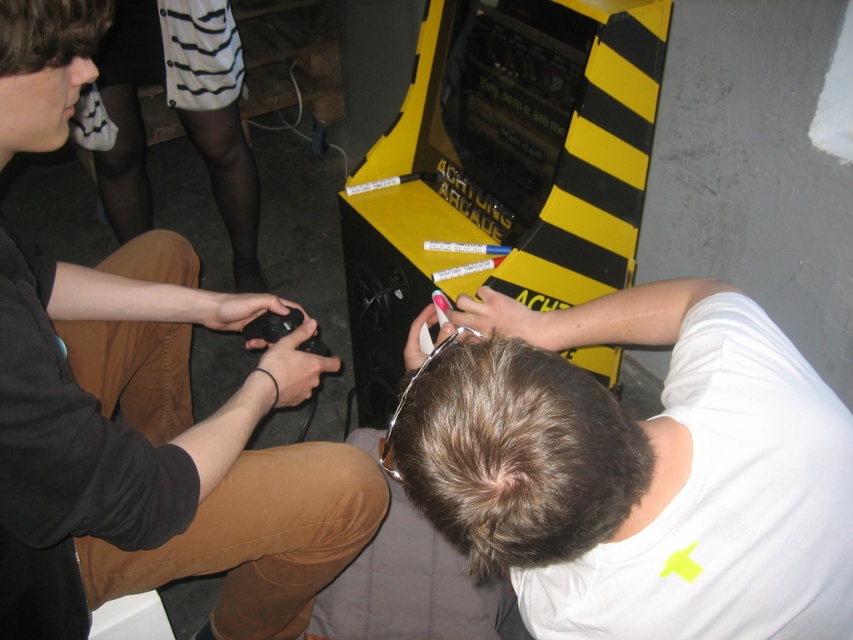
Between white matte shirt at lower right and dark brown hair at upper left, which one is positioned lower?

white matte shirt at lower right is below.

Who is positioned more to the right, white matte shirt at lower right or dark brown hair at upper left?

From the viewer's perspective, white matte shirt at lower right appears more on the right side.

Identify the location of white matte shirt at lower right. (639, 468).

Who is positioned more to the left, white matte shirt at lower right or dark brown hair at center?

Positioned to the left is dark brown hair at center.

At what (x,y) coordinates should I click in order to perform the action: click on white matte shirt at lower right. Please return your answer as a coordinate pair (x, y). This screenshot has height=640, width=853. Looking at the image, I should click on (639, 468).

Can you confirm if dark brown hair at center is positioned to the right of dark brown hair at upper left?

Indeed, dark brown hair at center is positioned on the right side of dark brown hair at upper left.

Is dark brown hair at center wider than dark brown hair at upper left?

Indeed, dark brown hair at center has a greater width compared to dark brown hair at upper left.

Does point (506, 440) come in front of point (42, 52)?

That is True.

Locate an element on the screen. The height and width of the screenshot is (640, 853). dark brown hair at center is located at coordinates (515, 452).